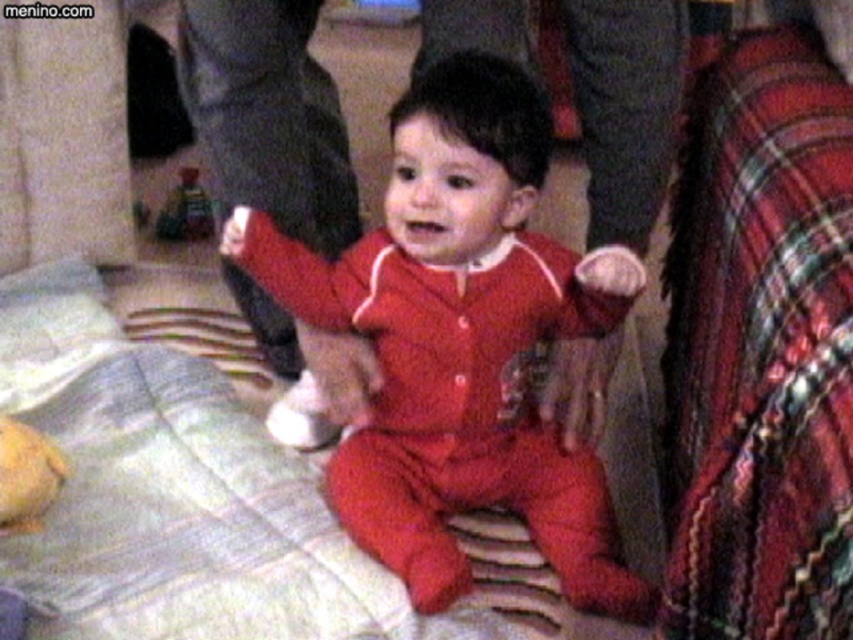
You are a photographer trying to focus on two points in the image. The first point is at coordinate point (605,250) and the second is at coordinate point (192,205). Which point is closer to your camera?

Point (605,250) is closer to the camera than point (192,205).

The baby is wearing the matte red pajamas at center and holding the plastic toy at center. Which item is taller?

The matte red pajamas at center is taller than the plastic toy at center.

You are a parent trying to decide if the plastic toy at center can fit inside the matte red pajamas at center. Based on their sizes, would the toy fit inside the pajamas?

The matte red pajamas at center has a width larger than the plastic toy at center, so the toy can fit inside the pajamas.